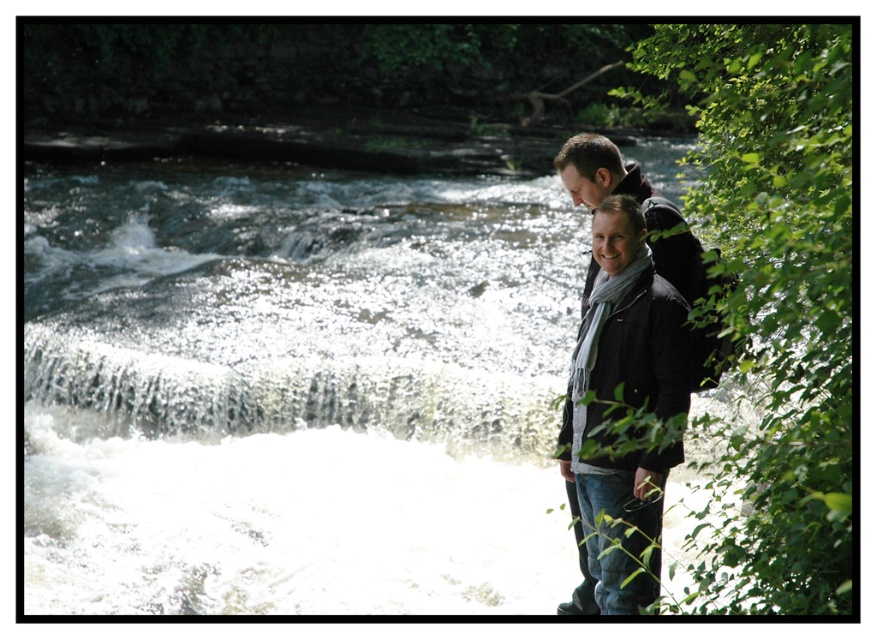
Image resolution: width=877 pixels, height=640 pixels. What do you see at coordinates (296, 390) in the screenshot?
I see `white frothy water at center` at bounding box center [296, 390].

In the scene shown: Can you confirm if white frothy water at center is smaller than matte black jacket at right?

Actually, white frothy water at center might be larger than matte black jacket at right.

I want to click on white frothy water at center, so click(296, 390).